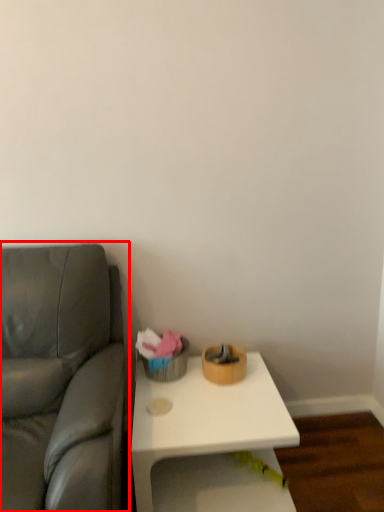
Question: From the image's perspective, where is studio couch (annotated by the red box) located relative to table?

Choices:
 (A) below
 (B) above

Answer: (B)